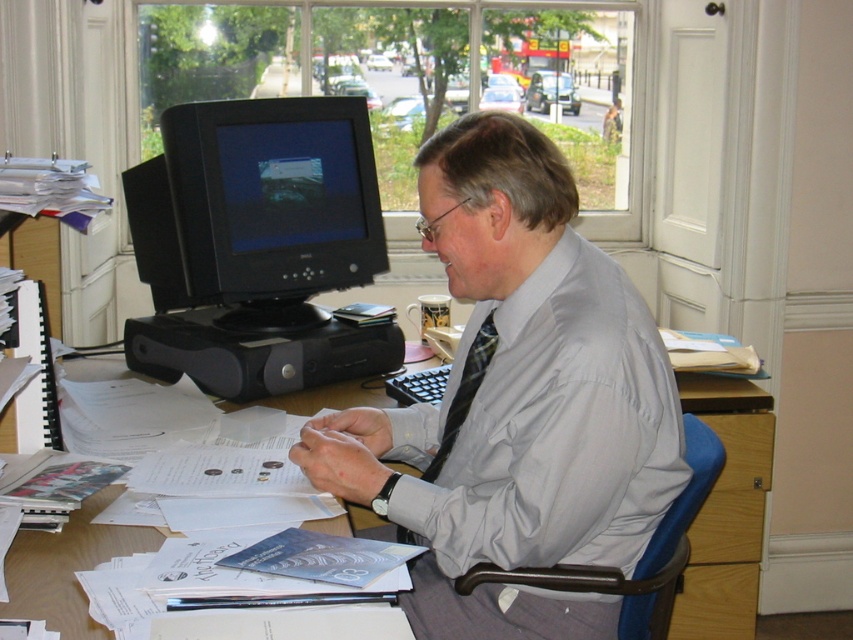
Question: Is matte black monitor at left further to the viewer compared to blue fabric swivel chair at right?

Choices:
 (A) yes
 (B) no

Answer: (A)

Question: Among these points, which one is farthest from the camera?

Choices:
 (A) (558, 264)
 (B) (608, 589)

Answer: (A)

Question: Where is matte black monitor at left located in relation to plaid fabric tie at center in the image?

Choices:
 (A) left
 (B) right

Answer: (A)

Question: Which point appears closest to the camera in this image?

Choices:
 (A) (251, 144)
 (B) (701, 509)

Answer: (A)

Question: Which of these objects is positioned farthest from the wooden desk at center?

Choices:
 (A) gray silk shirt at center
 (B) matte black monitor at left

Answer: (B)

Question: Can you confirm if gray silk shirt at center is wider than wooden desk at center?

Choices:
 (A) yes
 (B) no

Answer: (A)